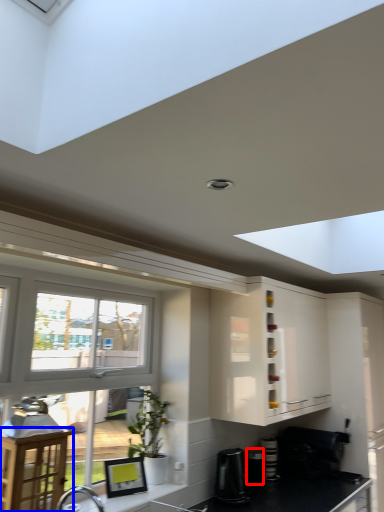
Question: Which of the following is the farthest to the observer, appliance (highlighted by a red box) or table (highlighted by a blue box)?

Choices:
 (A) appliance
 (B) table

Answer: (A)